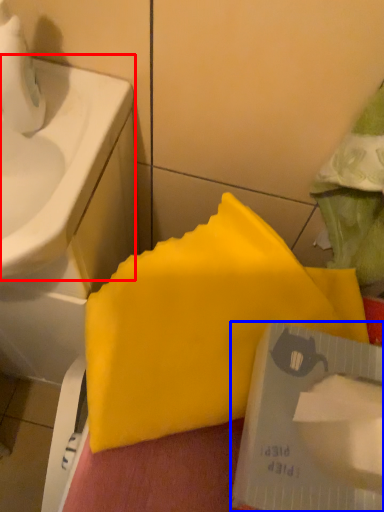
Question: Which of the following is the farthest to the observer, sink (highlighted by a red box) or writing (highlighted by a blue box)?

Choices:
 (A) sink
 (B) writing

Answer: (A)